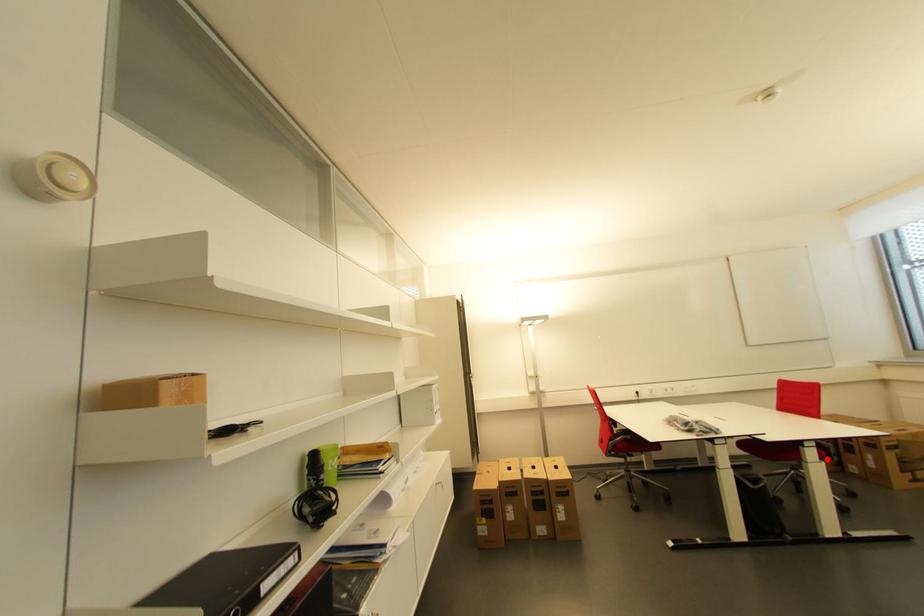
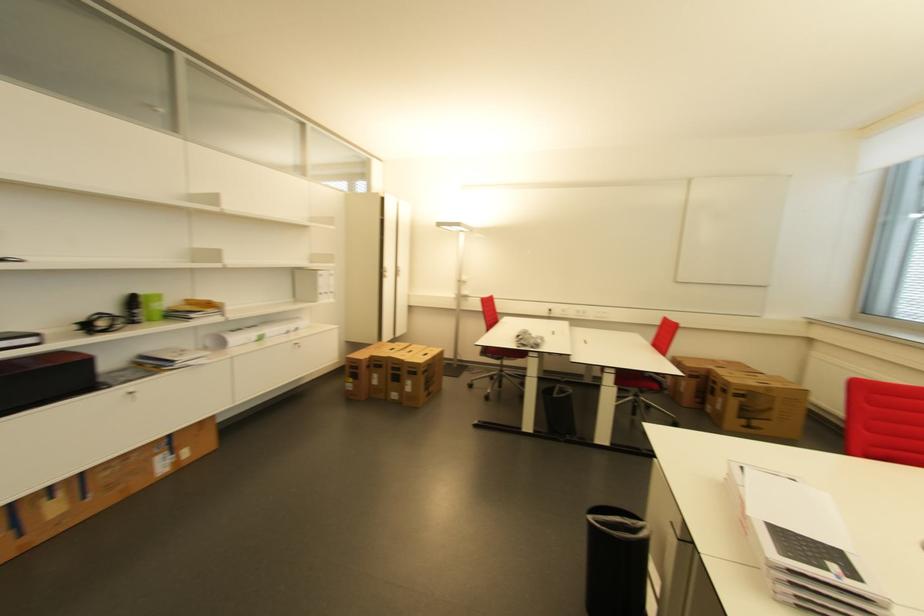
Where in the second image is the point corresponding to the highlighted location from the first image?

(622, 386)